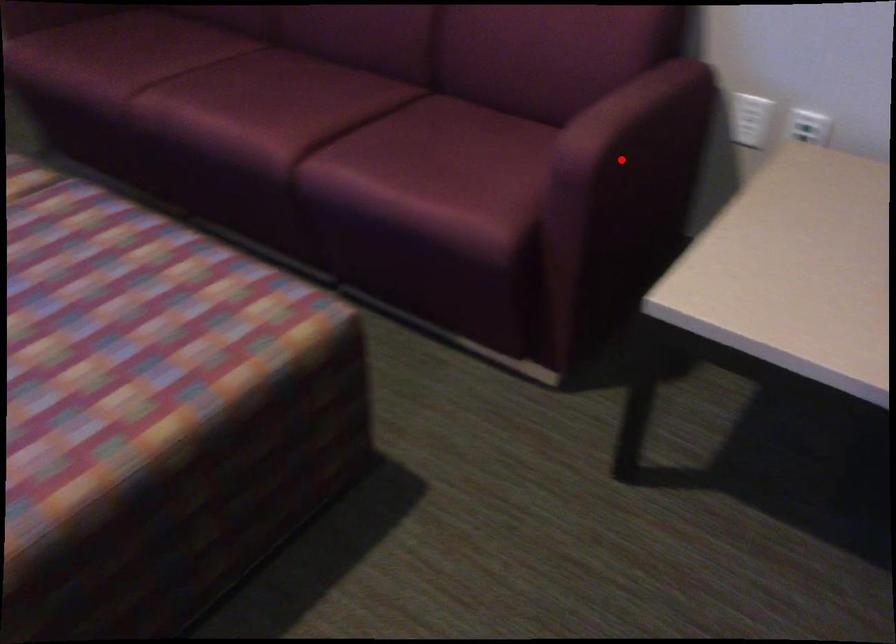
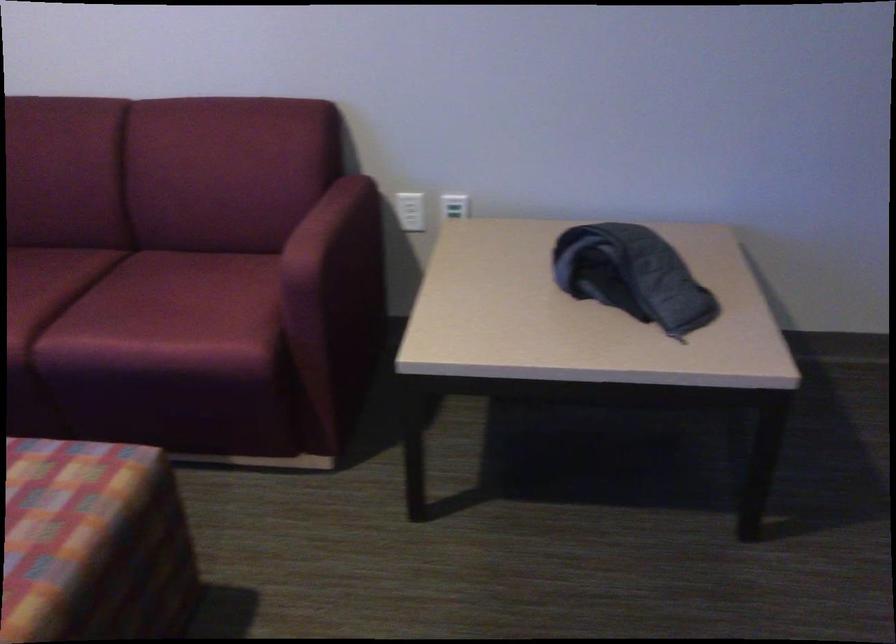
Locate, in the second image, the point that corresponds to the highlighted location in the first image.

(334, 259)